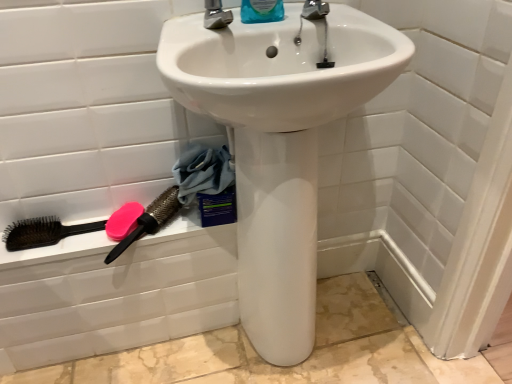
Where is `pink rubber brush at lower left, acting as the 3th brush starting from the left`? pink rubber brush at lower left, acting as the 3th brush starting from the left is located at coordinates (150, 220).

Where is `pink matte soap at lower left`? pink matte soap at lower left is located at coordinates (123, 221).

What do you see at coordinates (123, 221) in the screenshot? Image resolution: width=512 pixels, height=384 pixels. I see `pink matte soap at lower left` at bounding box center [123, 221].

Where is `white glossy sink at center`? The image size is (512, 384). white glossy sink at center is located at coordinates (279, 143).

You are a GUI agent. You are given a task and a screenshot of the screen. Output one action in this format:
    pyautogui.click(x=<x>, y=<y>)
    Task: Click on the pink rubber brush at lower left, which appears as the 1th brush when viewed from the right
    
    Given the screenshot: What is the action you would take?
    pyautogui.click(x=150, y=220)

Is black plastic brush at lower left, the 2th brush viewed from the left, oriented away from blue plastic bottle at upper center?

No, blue plastic bottle at upper center is not at the back of black plastic brush at lower left, the 2th brush viewed from the left.

Is black plastic brush at lower left, which appears as the second brush when viewed from the right, in contact with blue plastic bottle at upper center?

No.

Is blue plastic bottle at upper center a part of black plastic brush at lower left, the 2th brush viewed from the left?

No, blue plastic bottle at upper center is not surrounded by black plastic brush at lower left, the 2th brush viewed from the left.

Who is shorter, black plastic brush at lower left, which appears as the second brush when viewed from the right, or blue plastic bottle at upper center?

Standing shorter between the two is black plastic brush at lower left, which appears as the second brush when viewed from the right.

From a real-world perspective, is pink matte soap at lower left physically located above or below black plastic brush at lower left, which appears as the second brush when viewed from the right?

In terms of real-world spatial position, pink matte soap at lower left is above black plastic brush at lower left, which appears as the second brush when viewed from the right.

Could you tell me if pink matte soap at lower left is facing black plastic brush at lower left, which appears as the second brush when viewed from the right?

No.

Between pink matte soap at lower left and black plastic brush at lower left, the 2th brush viewed from the left, which one has larger width?

With larger width is black plastic brush at lower left, the 2th brush viewed from the left.

Measure the distance from pink matte soap at lower left to black plastic brush at lower left, the 2th brush viewed from the left.

They are 4.70 inches apart.

From the image's perspective, between white glossy sink at center and black plastic brush at lower left, which appears as the second brush when viewed from the right, who is located below?

From the image's view, black plastic brush at lower left, which appears as the second brush when viewed from the right, is below.

Based on the photo, considering the relative positions of white glossy sink at center and black plastic brush at lower left, which appears as the second brush when viewed from the right, in the image provided, is white glossy sink at center to the left of black plastic brush at lower left, which appears as the second brush when viewed from the right, from the viewer's perspective?

No.

Who is bigger, white glossy sink at center or black plastic brush at lower left, the 2th brush viewed from the left?

white glossy sink at center is bigger.

Is black plastic brush at lower left, the 2th brush viewed from the left, positioned with its back to brown bristle brush at lower left, the 1th brush in the left-to-right sequence?

No.

From the image's perspective, which is above, black plastic brush at lower left, the 2th brush viewed from the left, or brown bristle brush at lower left, which is counted as the third brush, starting from the right?

brown bristle brush at lower left, which is counted as the third brush, starting from the right, appears higher in the image.

From a real-world perspective, between black plastic brush at lower left, which appears as the second brush when viewed from the right, and brown bristle brush at lower left, the 1th brush in the left-to-right sequence, who is vertically higher?

From a 3D spatial view, brown bristle brush at lower left, the 1th brush in the left-to-right sequence, is above.

Between point (192, 167) and point (276, 9), which one is positioned behind?

The point (192, 167) is behind.

Looking at this image, from the image's perspective, between blue fabric at lower left and blue plastic bottle at upper center, who is located below?

blue fabric at lower left.

Does blue fabric at lower left have a lesser width compared to blue plastic bottle at upper center?

Incorrect, the width of blue fabric at lower left is not less than that of blue plastic bottle at upper center.

Considering the positions of objects blue fabric at lower left and blue plastic bottle at upper center in the image provided, who is more to the left, blue fabric at lower left or blue plastic bottle at upper center?

blue fabric at lower left.

Is blue fabric at lower left aimed at metallic silver faucet at upper center?

No, blue fabric at lower left does not turn towards metallic silver faucet at upper center.

In the image, is blue fabric at lower left positioned in front of or behind metallic silver faucet at upper center?

blue fabric at lower left is positioned farther from the viewer than metallic silver faucet at upper center.

From a real-world perspective, is blue fabric at lower left physically located above or below metallic silver faucet at upper center?

In terms of real-world spatial position, blue fabric at lower left is below metallic silver faucet at upper center.

Is white glossy sink at center inside blue fabric at lower left?

Actually, white glossy sink at center is outside blue fabric at lower left.

Where is `material behind the white glossy sink at center`? The height and width of the screenshot is (384, 512). material behind the white glossy sink at center is located at coordinates (202, 172).

Does blue fabric at lower left turn towards white glossy sink at center?

Yes, blue fabric at lower left is aimed at white glossy sink at center.

At what (x,y) coordinates should I click in order to perform the action: click on cleaning product in front of the black plastic brush at lower left, the 2th brush viewed from the left. Please return your answer as a coordinate pair (x, y). This screenshot has width=512, height=384. Looking at the image, I should click on (261, 11).

Image resolution: width=512 pixels, height=384 pixels. Identify the location of soap on the right of black plastic brush at lower left, which appears as the second brush when viewed from the right. 123,221.

Which object lies nearer to the anchor point white glossy sink at center, metallic silver faucet at upper center or pink rubber brush at lower left, acting as the 3th brush starting from the left?

pink rubber brush at lower left, acting as the 3th brush starting from the left.

From the image, which object appears to be nearer to white glossy sink at center, pink matte soap at lower left or metallic silver faucet at upper center?

metallic silver faucet at upper center is closer to white glossy sink at center.

Which object lies nearer to the anchor point white glossy sink at center, pink matte soap at lower left or black plastic brush at lower left, which appears as the second brush when viewed from the right?

Based on the image, black plastic brush at lower left, which appears as the second brush when viewed from the right, appears to be nearer to white glossy sink at center.

Which object lies nearer to the anchor point pink matte soap at lower left, pink rubber brush at lower left, which appears as the 1th brush when viewed from the right, or black plastic brush at lower left, which appears as the second brush when viewed from the right?

pink rubber brush at lower left, which appears as the 1th brush when viewed from the right.

Considering their positions, is metallic silver faucet at upper center positioned further to white glossy sink at center than brown bristle brush at lower left, the 1th brush in the left-to-right sequence?

Among the two, brown bristle brush at lower left, the 1th brush in the left-to-right sequence, is located further to white glossy sink at center.

From the picture: Which object lies nearer to the anchor point pink rubber brush at lower left, which appears as the 1th brush when viewed from the right, black plastic brush at lower left, the 2th brush viewed from the left, or metallic silver faucet at upper center?

black plastic brush at lower left, the 2th brush viewed from the left, lies closer to pink rubber brush at lower left, which appears as the 1th brush when viewed from the right, than the other object.

Based on their spatial positions, is blue plastic bottle at upper center or brown bristle brush at lower left, which is counted as the third brush, starting from the right, further from metallic silver faucet at upper center?

Based on the image, brown bristle brush at lower left, which is counted as the third brush, starting from the right, appears to be further to metallic silver faucet at upper center.

Considering their positions, is blue fabric at lower left positioned further to pink matte soap at lower left than blue plastic bottle at upper center?

blue plastic bottle at upper center lies further to pink matte soap at lower left than the other object.

Identify the location of tap between blue plastic bottle at upper center and black plastic brush at lower left, which appears as the second brush when viewed from the right, in the vertical direction. This screenshot has height=384, width=512. (216, 15).

What are the coordinates of `sink between metallic silver faucet at upper center and pink matte soap at lower left vertically` in the screenshot? It's located at (279, 143).

Locate an element on the screen. The height and width of the screenshot is (384, 512). tap that lies between blue plastic bottle at upper center and white glossy sink at center from top to bottom is located at coordinates (216, 15).

This screenshot has height=384, width=512. What are the coordinates of `material between blue plastic bottle at upper center and brown bristle brush at lower left, the 1th brush in the left-to-right sequence, in the up-down direction` in the screenshot? It's located at (202, 172).